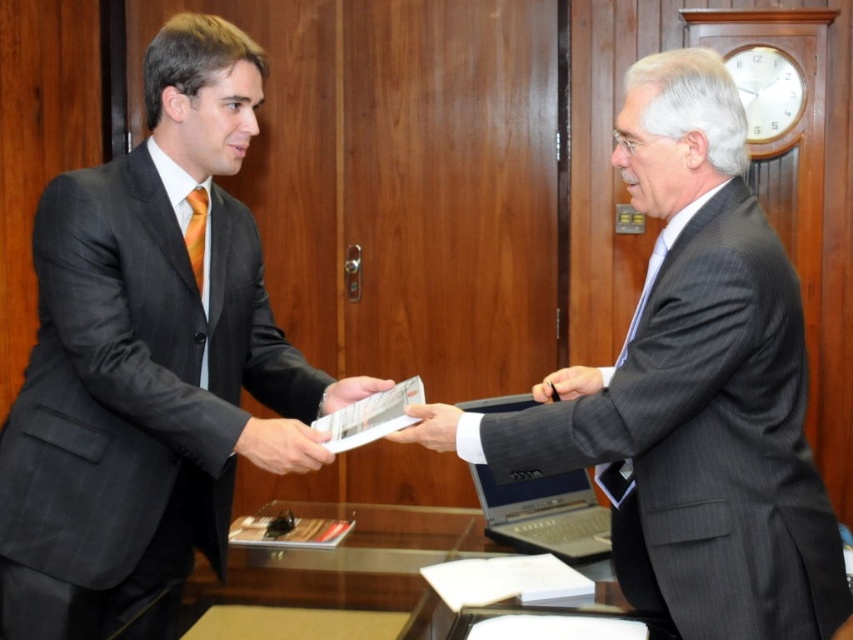
This screenshot has width=853, height=640. Describe the element at coordinates (143, 358) in the screenshot. I see `matte black suit at left` at that location.

Does point (125, 588) lie behind point (602, 397)?

Yes, it is behind point (602, 397).

Is point (123, 602) positioned before point (701, 106)?

No, it is not.

In order to click on matte black suit at left in this screenshot , I will do `click(143, 358)`.

This screenshot has width=853, height=640. I want to click on gray pinstripe suit at center, so click(697, 388).

Locate an element on the screen. gray pinstripe suit at center is located at coordinates (697, 388).

Can you confirm if white matte paper at center is bigger than matte paper at center?

Yes.

Between white matte paper at center and matte paper at center, which one appears on the right side from the viewer's perspective?

white matte paper at center

Does point (415, 410) come farther from viewer compared to point (352, 384)?

No, it is in front of (352, 384).

You are a GUI agent. You are given a task and a screenshot of the screen. Output one action in this format:
    pyautogui.click(x=<x>, y=<y>)
    Task: Click on the white matte paper at center
    The image size is (853, 640).
    Given the screenshot: What is the action you would take?
    pyautogui.click(x=430, y=426)